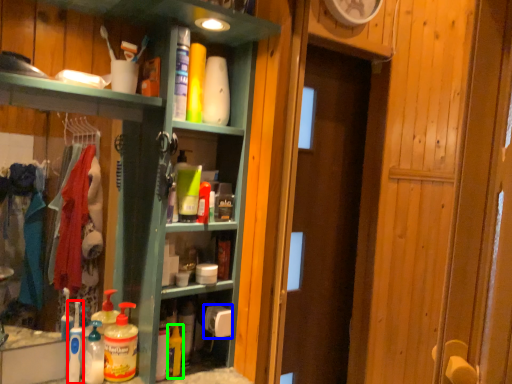
Question: Estimate the real-world distances between objects in this image. Which object is closer to cleaning product (highlighted by a red box), toilet paper (highlighted by a blue box) or cleaning product (highlighted by a green box)?

Choices:
 (A) toilet paper
 (B) cleaning product

Answer: (B)